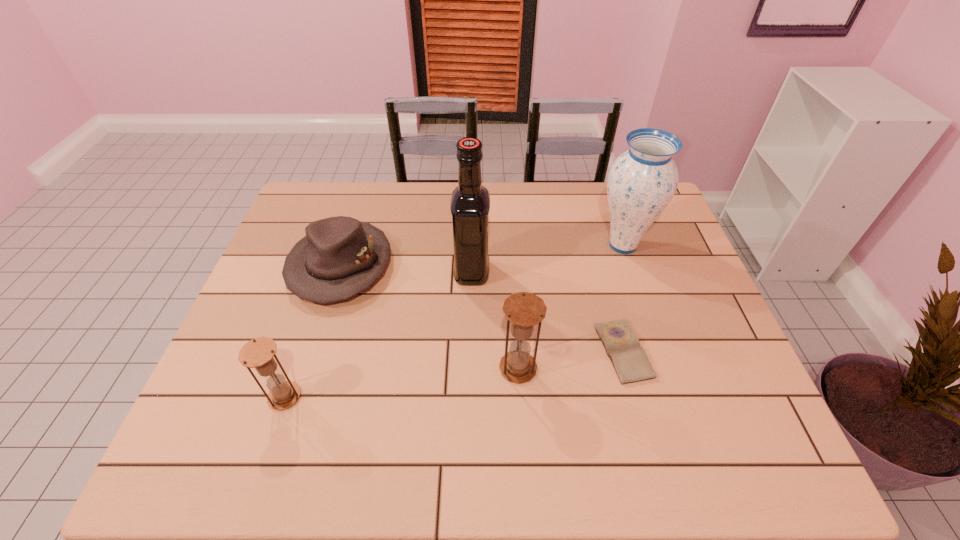
Locate an element on the screen. The width and height of the screenshot is (960, 540). free region at the near edge is located at coordinates (285, 419).

This screenshot has height=540, width=960. Identify the location of vacant space at the left edge. (293, 305).

Image resolution: width=960 pixels, height=540 pixels. In the image, there is a desktop. Find the location of `vacant space at the right edge`. vacant space at the right edge is located at coordinates (675, 260).

In order to click on free space at the near left corner of the desktop in this screenshot , I will do `click(212, 414)`.

Image resolution: width=960 pixels, height=540 pixels. What are the coordinates of `free spot between the fourth object from right to left and the fourth tallest object` in the screenshot? It's located at (378, 334).

Find the location of a particular element. The height and width of the screenshot is (540, 960). vacant region between the vase and the left hourglass is located at coordinates (454, 321).

At what (x,y) coordinates should I click in order to perform the action: click on vacant area that lies between the third tallest object and the third shortest object. Please return your answer as a coordinate pair (x, y). Looking at the image, I should click on (401, 382).

Locate an element on the screen. The height and width of the screenshot is (540, 960). unoccupied area between the second shortest object and the diary is located at coordinates (482, 308).

At what (x,y) coordinates should I click in order to perform the action: click on empty space that is in between the liquor and the third shortest object. Please return your answer as a coordinate pair (x, y). The width and height of the screenshot is (960, 540). Looking at the image, I should click on (378, 334).

Find the location of a particular element. The image size is (960, 540). blank region between the fifth tallest object and the left hourglass is located at coordinates (313, 331).